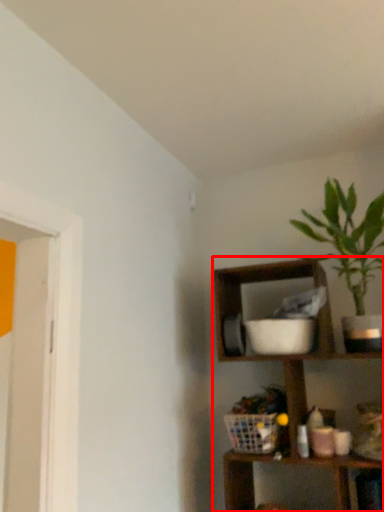
Question: In this image, where is shelf (annotated by the red box) located relative to houseplant?

Choices:
 (A) right
 (B) left

Answer: (B)